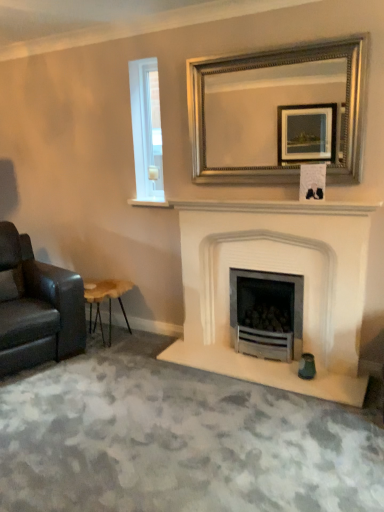
Question: From a real-world perspective, is white marble fireplace at center beneath white glass window at upper left?

Choices:
 (A) yes
 (B) no

Answer: (A)

Question: Is white marble fireplace at center touching white glass window at upper left?

Choices:
 (A) yes
 (B) no

Answer: (B)

Question: Considering the relative positions of white marble fireplace at center and white glass window at upper left in the image provided, is white marble fireplace at center behind white glass window at upper left?

Choices:
 (A) no
 (B) yes

Answer: (A)

Question: Does white marble fireplace at center appear on the left side of white glass window at upper left?

Choices:
 (A) no
 (B) yes

Answer: (A)

Question: From the image's perspective, is white marble fireplace at center on top of white glass window at upper left?

Choices:
 (A) yes
 (B) no

Answer: (B)

Question: From the image's perspective, is wooden stool at lower left located above or below silver/golden metallic mirror at upper center?

Choices:
 (A) above
 (B) below

Answer: (B)

Question: Considering the relative positions of wooden stool at lower left and silver/golden metallic mirror at upper center in the image provided, is wooden stool at lower left to the left or to the right of silver/golden metallic mirror at upper center?

Choices:
 (A) left
 (B) right

Answer: (A)

Question: Looking at their shapes, would you say wooden stool at lower left is wider or thinner than silver/golden metallic mirror at upper center?

Choices:
 (A) thin
 (B) wide

Answer: (B)

Question: In terms of height, does wooden stool at lower left look taller or shorter compared to silver/golden metallic mirror at upper center?

Choices:
 (A) tall
 (B) short

Answer: (B)

Question: Looking at their shapes, would you say white stone fireplace at center is wider or thinner than white marble fireplace at center?

Choices:
 (A) wide
 (B) thin

Answer: (A)

Question: In the image, is white stone fireplace at center on the left side or the right side of white marble fireplace at center?

Choices:
 (A) left
 (B) right

Answer: (B)

Question: Does point (314, 394) appear closer or farther from the camera than point (350, 204)?

Choices:
 (A) farther
 (B) closer

Answer: (A)

Question: Relative to white marble fireplace at center, is white stone fireplace at center in front or behind?

Choices:
 (A) behind
 (B) front

Answer: (B)

Question: Relative to silver/golden metallic mirror at upper center, is white glass window at upper left in front or behind?

Choices:
 (A) front
 (B) behind

Answer: (B)

Question: Is point (145, 79) closer or farther from the camera than point (213, 68)?

Choices:
 (A) farther
 (B) closer

Answer: (A)